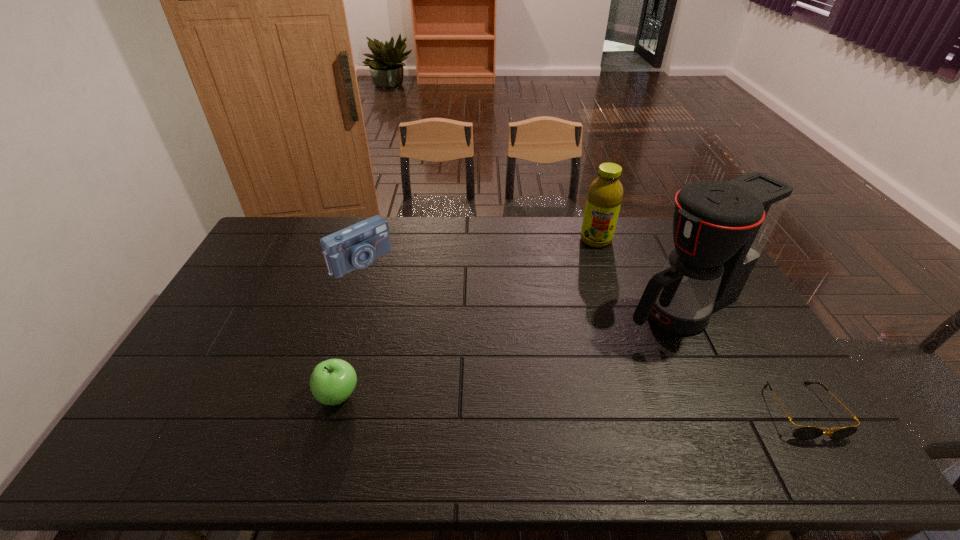
Find the location of a particular element. This screenshot has width=960, height=540. empty location between the camera and the second shortest object is located at coordinates (349, 328).

You are a GUI agent. You are given a task and a screenshot of the screen. Output one action in this format:
    pyautogui.click(x=<x>, y=<y>)
    Task: Click on the free space between the shortest object and the apple
    This screenshot has height=540, width=960.
    Given the screenshot: What is the action you would take?
    pyautogui.click(x=570, y=403)

Find the location of a particular element. The width and height of the screenshot is (960, 540). vacant area that lies between the sunglasses and the camera is located at coordinates (581, 336).

Where is `free space between the tallest object and the camera`? free space between the tallest object and the camera is located at coordinates pos(521,284).

You are a GUI agent. You are given a task and a screenshot of the screen. Output one action in this format:
    pyautogui.click(x=<x>, y=<y>)
    Task: Click on the free spot between the second shortest object and the camera
    The width and height of the screenshot is (960, 540).
    Given the screenshot: What is the action you would take?
    pyautogui.click(x=349, y=328)

I want to click on vacant area that lies between the second tallest object and the coffee maker, so click(x=638, y=274).

This screenshot has width=960, height=540. What are the coordinates of `unoccupied position between the camera and the apple` in the screenshot? It's located at click(349, 328).

Find the location of a particular element. The height and width of the screenshot is (540, 960). empty space that is in between the tallest object and the apple is located at coordinates (510, 352).

This screenshot has width=960, height=540. I want to click on object that is the closest to the second tallest object, so click(x=720, y=229).

Identify which object is the third nearest to the camera. Please provide its 2D coordinates. Your answer should be formatted as a tuple, i.e. [(x, y)], where the tuple contains the x and y coordinates of a point satisfying the conditions above.

[(720, 229)]